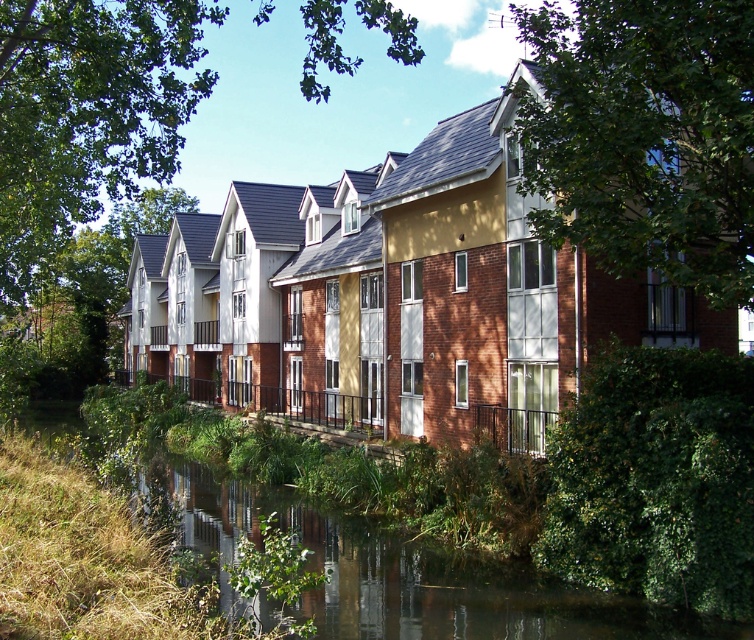
Describe the element at coordinates (644, 136) in the screenshot. I see `green leafy tree at upper center` at that location.

What do you see at coordinates (644, 136) in the screenshot? The width and height of the screenshot is (754, 640). I see `green leafy tree at upper center` at bounding box center [644, 136].

Where is `green leafy tree at upper center`? This screenshot has height=640, width=754. green leafy tree at upper center is located at coordinates (x=644, y=136).

Consider the image. Can you confirm if green leafy tree at upper left is positioned to the left of green grassy bank at lower left?

Correct, you'll find green leafy tree at upper left to the left of green grassy bank at lower left.

Who is higher up, green leafy tree at upper left or green grassy bank at lower left?

green leafy tree at upper left

Is point (143, 12) positioned in front of point (599, 605)?

No, (143, 12) is behind (599, 605).

The height and width of the screenshot is (640, 754). Find the location of `green leafy tree at upper left`. green leafy tree at upper left is located at coordinates (87, 109).

Does green leafy tree at upper center come in front of green grassy bank at lower left?

No.

Between point (558, 230) and point (198, 481), which one is positioned behind?

Point (198, 481)

What do you see at coordinates (644, 136) in the screenshot?
I see `green leafy tree at upper center` at bounding box center [644, 136].

You are a GUI agent. You are given a task and a screenshot of the screen. Output one action in this format:
    pyautogui.click(x=<x>, y=<y>)
    Task: Click on the green leafy tree at upper center
    
    Given the screenshot: What is the action you would take?
    pyautogui.click(x=644, y=136)